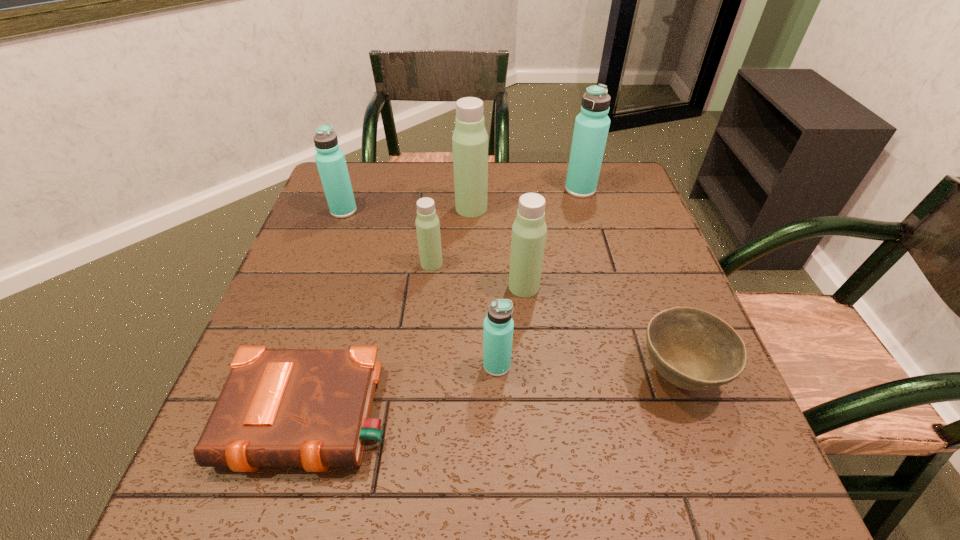
Image resolution: width=960 pixels, height=540 pixels. I want to click on the rightmost aqua thermos bottle, so click(591, 128).

Identify the location of the farthest aqua thermos bottle. Image resolution: width=960 pixels, height=540 pixels. (591, 128).

Find the location of a particular element. the biggest light thermos bottle is located at coordinates point(470,139).

At what (x,y) coordinates should I click in order to perform the action: click on the second light thermos bottle from left to right. Please return your answer as a coordinate pair (x, y). Looking at the image, I should click on (x=470, y=139).

The width and height of the screenshot is (960, 540). Find the location of `the leftmost thermos bottle`. the leftmost thermos bottle is located at coordinates (330, 159).

The width and height of the screenshot is (960, 540). I want to click on the leftmost aqua thermos bottle, so click(330, 159).

The height and width of the screenshot is (540, 960). What are the coordinates of `the rightmost light thermos bottle` in the screenshot? It's located at (529, 229).

Find the location of `the second nearest thermos bottle`. the second nearest thermos bottle is located at coordinates (529, 229).

I want to click on the third object from left to right, so click(427, 223).

Image resolution: width=960 pixels, height=540 pixels. In order to click on the smallest light thermos bottle in this screenshot , I will do `click(427, 223)`.